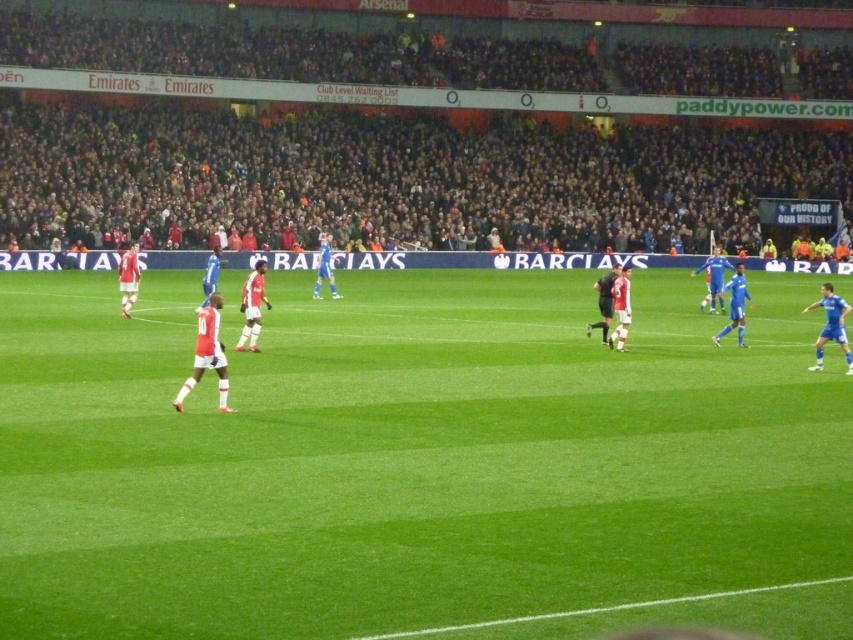
You are a photographer standing at the center of the soccer field. You want to take a photo that includes both the point at coordinates point (450, 419) and point (49, 170). Which point will appear larger in the photo?

Point (450, 419) is closer to the camera than point (49, 170), so it will appear larger in the photo.

You are a drone operator trying to capture a photo of the soccer match. Your drone is currently above the green grass field at center. To get a better shot, you need to move it towards the dark gray crowd at upper center. In which direction should you direct the drone to fly?

The green grass field at center is positioned under the dark gray crowd at upper center, so you should direct the drone to fly upward to reach the dark gray crowd at upper center.

You are a drone operator trying to capture aerial footage of the soccer match. Your camera is currently positioned at point A, which is at coordinates. What direction should you move the camera to get a clear shot of the green grass field at center?

The green grass field at center is located at coordinates point A, so you don not need to move the camera to capture it.